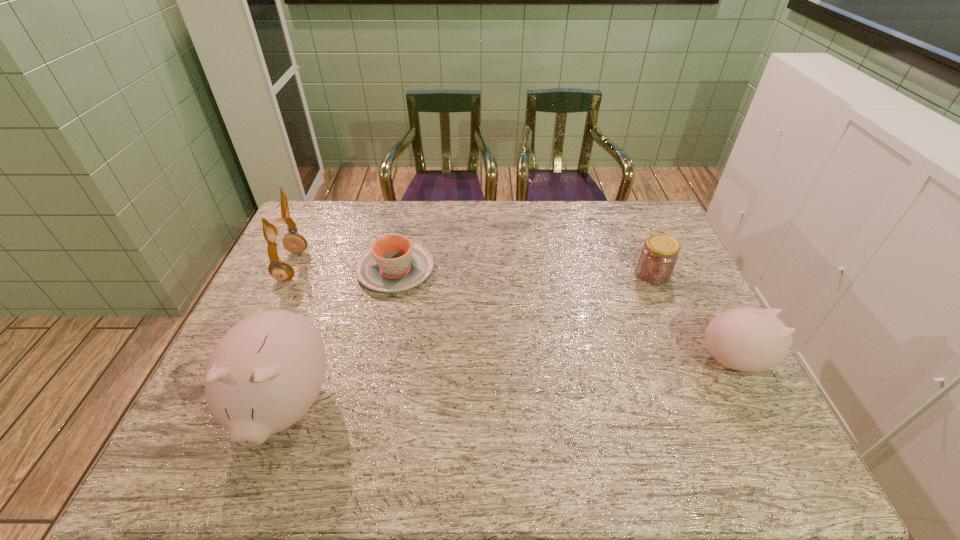
Where is `free space at the right edge of the desktop`? This screenshot has height=540, width=960. free space at the right edge of the desktop is located at coordinates (685, 334).

The image size is (960, 540). I want to click on free space at the far right corner, so click(x=632, y=237).

Where is `free point between the jam and the shorter piggy bank`? free point between the jam and the shorter piggy bank is located at coordinates (695, 317).

Image resolution: width=960 pixels, height=540 pixels. What are the coordinates of `vacant area that lies between the left piggy bank and the shorter piggy bank` in the screenshot? It's located at (511, 383).

Where is `free spot between the right piggy bank and the fourth tallest object`? The image size is (960, 540). free spot between the right piggy bank and the fourth tallest object is located at coordinates (695, 317).

Locate an element on the screen. This screenshot has width=960, height=540. free space between the earphone and the shortest object is located at coordinates (344, 268).

At what (x,y) coordinates should I click in order to perform the action: click on vacant area that lies between the second shortest object and the left piggy bank. Please return your answer as a coordinate pair (x, y). Image resolution: width=960 pixels, height=540 pixels. Looking at the image, I should click on (468, 340).

The image size is (960, 540). I want to click on vacant point located between the shorter piggy bank and the jam, so click(695, 317).

You are a GUI agent. You are given a task and a screenshot of the screen. Output one action in this format:
    pyautogui.click(x=<x>, y=<y>)
    Task: Click on the vacant space that is in between the earphone and the shorter piggy bank
    Image resolution: width=960 pixels, height=540 pixels.
    Given the screenshot: What is the action you would take?
    pyautogui.click(x=515, y=313)

Image resolution: width=960 pixels, height=540 pixels. In order to click on vacant space that's between the jam and the chinaware in this screenshot , I will do `click(524, 272)`.